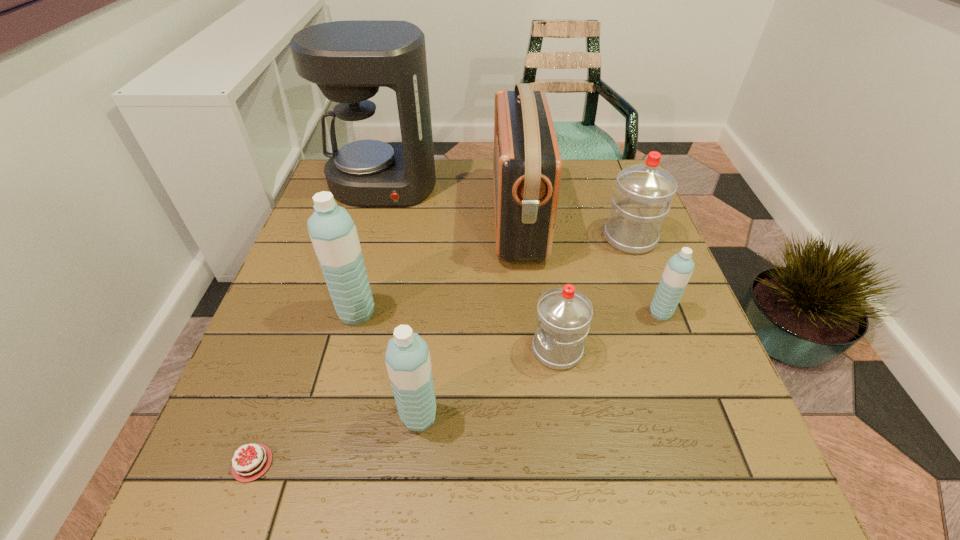
Where is `the left white water bottle`? the left white water bottle is located at coordinates (564, 314).

Where is `the smaller white water bottle`? the smaller white water bottle is located at coordinates (564, 314).

The width and height of the screenshot is (960, 540). In order to click on red chocolate cake in this screenshot , I will do `click(247, 466)`.

This screenshot has width=960, height=540. Identify the location of chocolate cake. tap(247, 466).

Locate an element on the screen. This screenshot has width=960, height=540. vacant region located 0.060m on the button side of the dark coffee maker is located at coordinates (372, 223).

The image size is (960, 540). Find the location of `free space located on the front-facing side of the radio receiver`. free space located on the front-facing side of the radio receiver is located at coordinates (427, 219).

You are a GUI agent. You are given a task and a screenshot of the screen. Output one action in this format:
    pyautogui.click(x=<x>, y=<y>)
    Task: Click on the vacant point located on the front-facing side of the radio receiver
    The width and height of the screenshot is (960, 540).
    Given the screenshot: What is the action you would take?
    pyautogui.click(x=363, y=219)

Image resolution: width=960 pixels, height=540 pixels. I want to click on free spot located 0.220m on the front-facing side of the radio receiver, so [412, 219].

Locate an element on the screen. This screenshot has width=960, height=540. vacant area situated on the front of the biggest blue water bottle is located at coordinates (306, 507).

Find the location of a particular element. Image resolution: width=960 pixels, height=540 pixels. free space located on the handle side of the farther white water bottle is located at coordinates (610, 184).